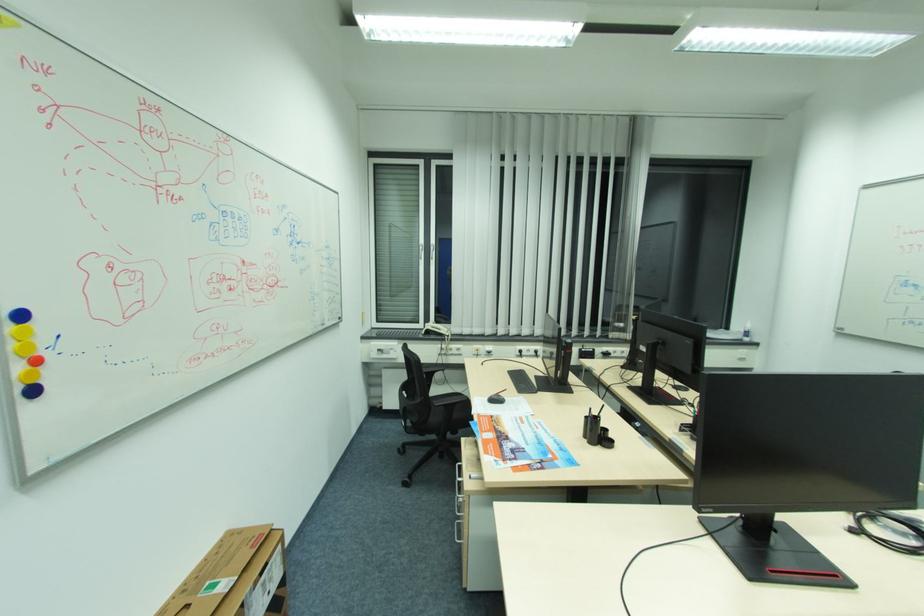
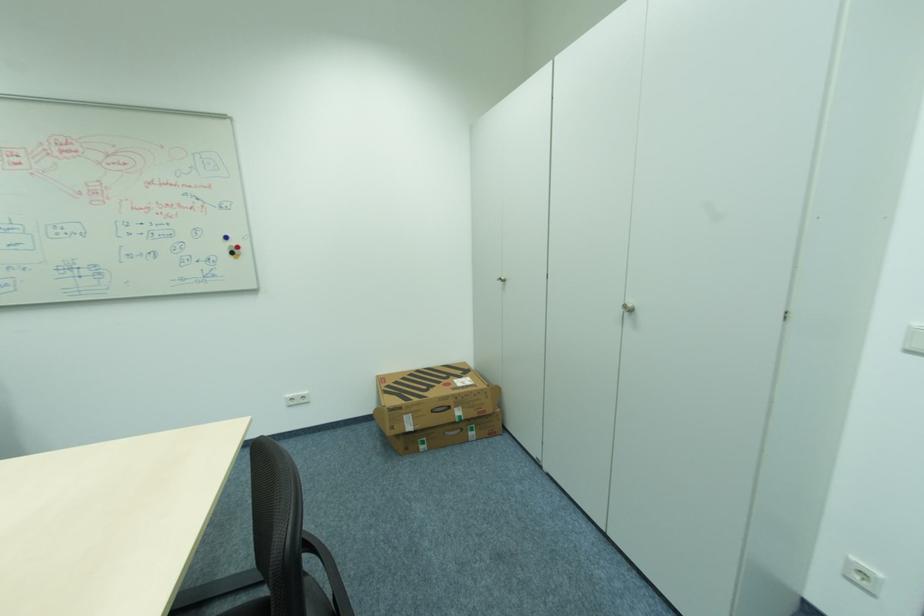
The images are taken continuously from a first-person perspective. In which direction is your viewpoint rotating?

The camera rotated toward right-down.